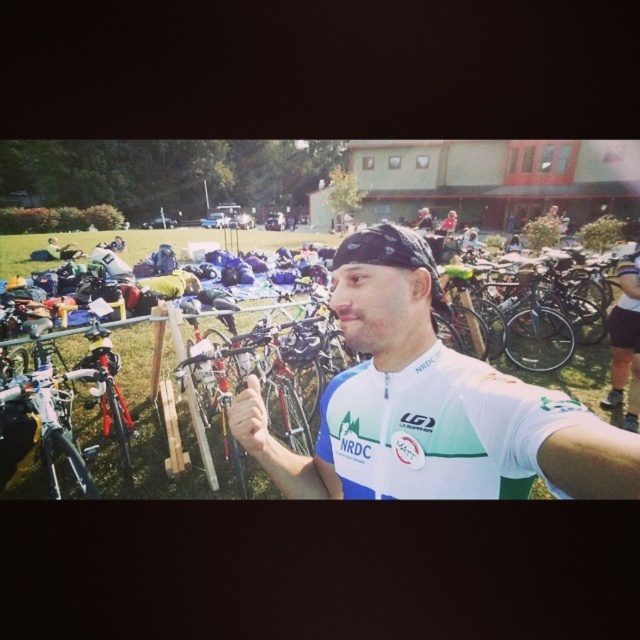
Question: Does white jersey at center appear under matte black helmet at center?

Choices:
 (A) yes
 (B) no

Answer: (B)

Question: Which point is farther from the camera taking this photo?

Choices:
 (A) (314, 348)
 (B) (252, 403)

Answer: (A)

Question: Which point appears closest to the camera in this image?

Choices:
 (A) (522, 454)
 (B) (316, 332)
 (C) (250, 445)

Answer: (A)

Question: Estimate the real-world distances between objects in this image. Which object is farther from the matte black helmet at center?

Choices:
 (A) white jersey at center
 (B) white matte hand at center

Answer: (A)

Question: Does white matte hand at center appear under matte black helmet at center?

Choices:
 (A) yes
 (B) no

Answer: (A)

Question: Is white jersey at center to the right of matte black helmet at center from the viewer's perspective?

Choices:
 (A) yes
 (B) no

Answer: (A)